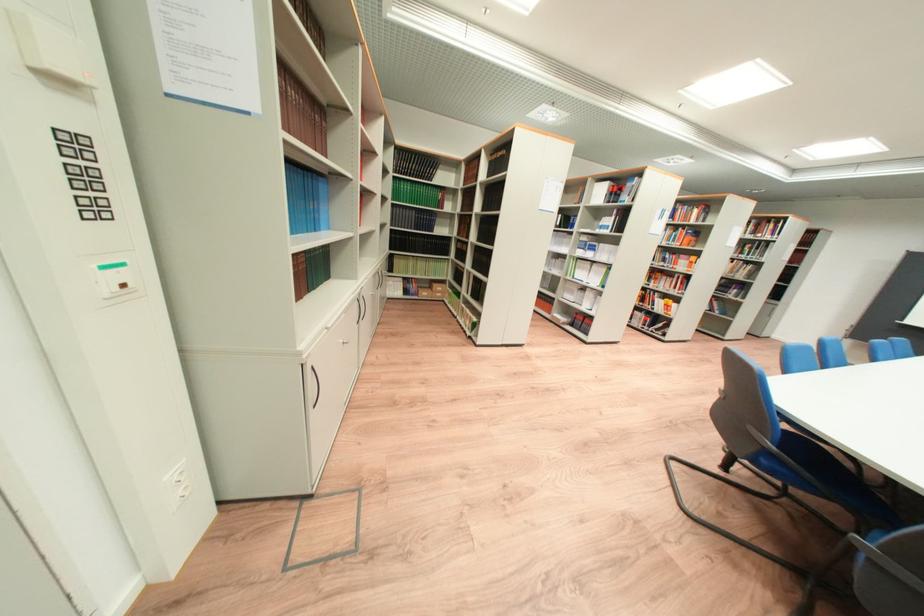
Describe the element at coordinates (114, 278) in the screenshot. I see `a square control button` at that location.